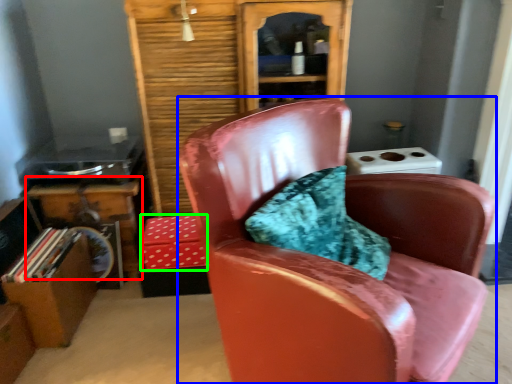
Question: Which object is the closest to the table (highlighted by a red box)? Choose among these: chair (highlighted by a blue box) or box (highlighted by a green box).

Choices:
 (A) chair
 (B) box

Answer: (B)